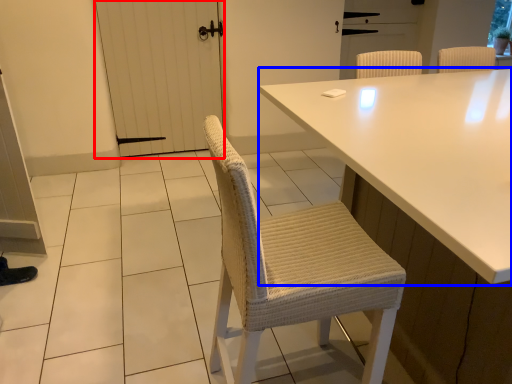
Question: Which object appears farthest to the camera in this image, screen door (highlighted by a red box) or table (highlighted by a blue box)?

Choices:
 (A) screen door
 (B) table

Answer: (A)